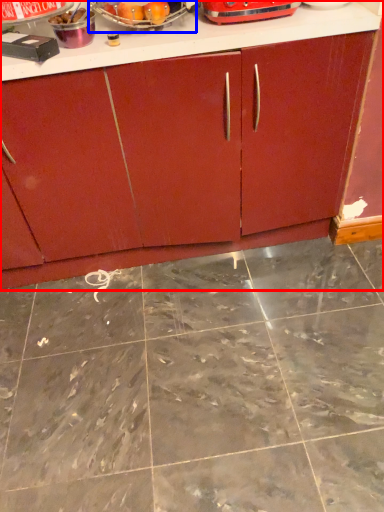
Question: Which of the following is the farthest to the observer, cabinetry (highlighted by a red box) or appliance (highlighted by a blue box)?

Choices:
 (A) cabinetry
 (B) appliance

Answer: (B)